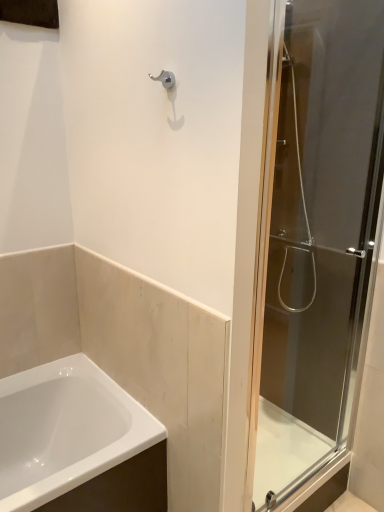
Question: From the image's perspective, is white glossy bathtub at lower left located beneath transparent glass shower door at right?

Choices:
 (A) yes
 (B) no

Answer: (A)

Question: Is white glossy bathtub at lower left aimed at transparent glass shower door at right?

Choices:
 (A) no
 (B) yes

Answer: (A)

Question: Is transparent glass shower door at right a part of white glossy bathtub at lower left?

Choices:
 (A) yes
 (B) no

Answer: (B)

Question: From a real-world perspective, is white glossy bathtub at lower left physically below transparent glass shower door at right?

Choices:
 (A) no
 (B) yes

Answer: (B)

Question: Is white glossy bathtub at lower left positioned beyond the bounds of transparent glass shower door at right?

Choices:
 (A) yes
 (B) no

Answer: (A)

Question: Considering the relative positions of white glossy bathtub at lower left and transparent glass shower door at right in the image provided, is white glossy bathtub at lower left to the left of transparent glass shower door at right from the viewer's perspective?

Choices:
 (A) no
 (B) yes

Answer: (B)

Question: Is transparent glass shower door at right looking in the opposite direction of white glossy bathtub at lower left?

Choices:
 (A) no
 (B) yes

Answer: (A)

Question: Could you tell me if transparent glass shower door at right is turned towards white glossy bathtub at lower left?

Choices:
 (A) no
 (B) yes

Answer: (A)

Question: From a real-world perspective, is transparent glass shower door at right on white glossy bathtub at lower left?

Choices:
 (A) no
 (B) yes

Answer: (B)

Question: Is transparent glass shower door at right taller than white glossy bathtub at lower left?

Choices:
 (A) no
 (B) yes

Answer: (B)

Question: Is transparent glass shower door at right outside of white glossy bathtub at lower left?

Choices:
 (A) no
 (B) yes

Answer: (B)

Question: Does transparent glass shower door at right have a lesser height compared to white glossy bathtub at lower left?

Choices:
 (A) yes
 (B) no

Answer: (B)

Question: From the image's perspective, relative to white glossy bathtub at lower left, is transparent glass shower door at right above or below?

Choices:
 (A) above
 (B) below

Answer: (A)